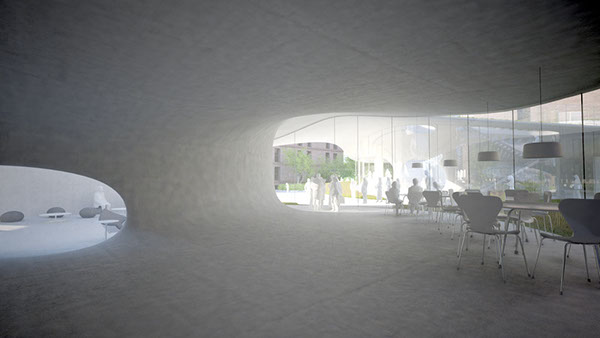
Locate an element on the screen. table is located at coordinates (538, 206).